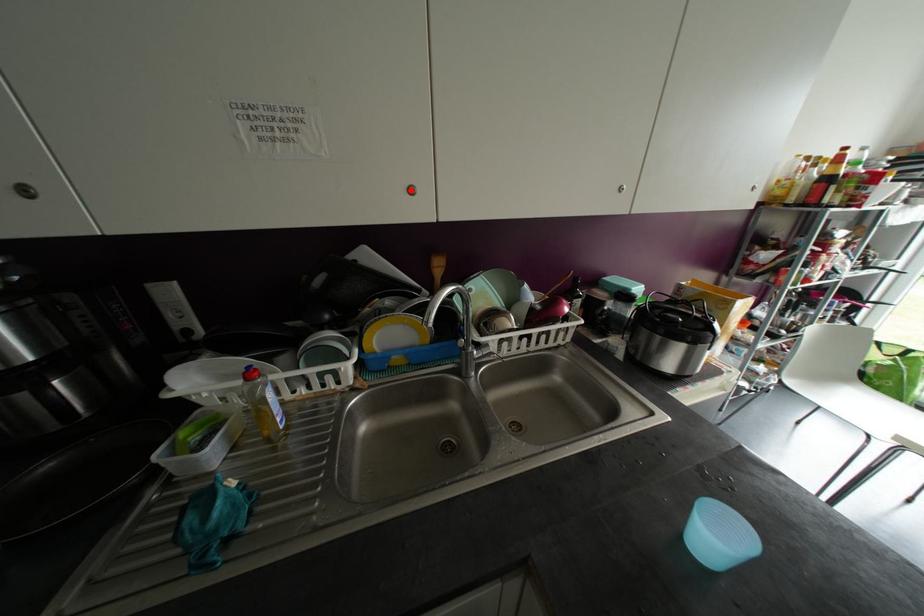
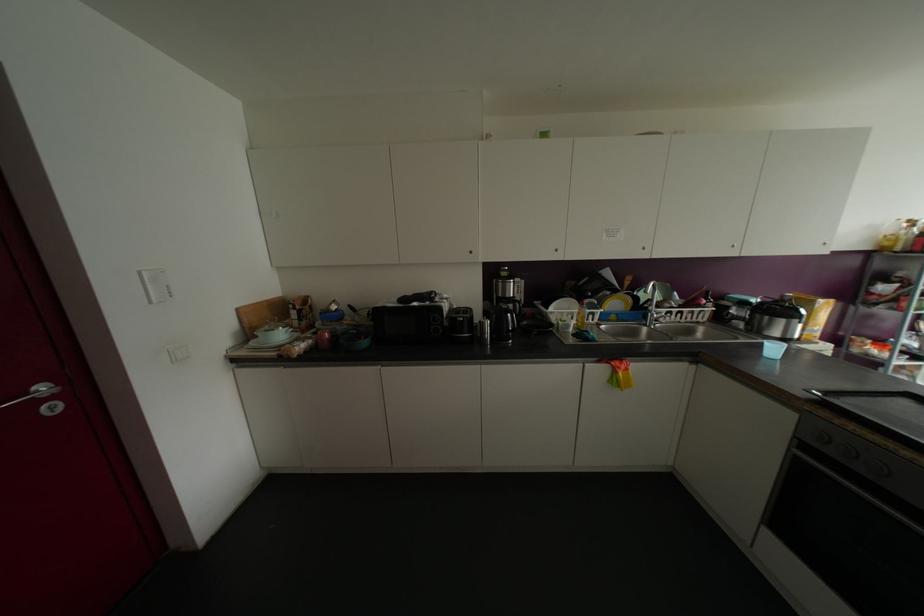
Where in the second image is the point corresponding to the highlighted location from the first image?

(642, 248)